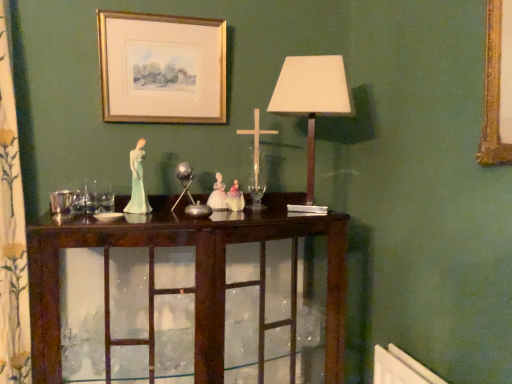
Locate an element on the screen. Image resolution: width=512 pixels, height=384 pixels. vacant area in front of porcelain figure at center is located at coordinates (123, 221).